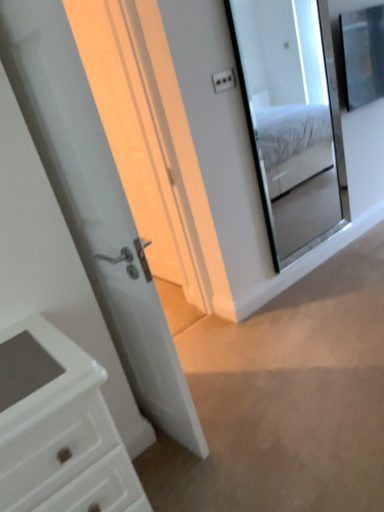
Question: Can white glossy door at center be found inside clear glass mirror at upper right?

Choices:
 (A) no
 (B) yes

Answer: (A)

Question: Considering the relative positions of clear glass mirror at upper right and white glossy door at center in the image provided, is clear glass mirror at upper right in front of white glossy door at center?

Choices:
 (A) yes
 (B) no

Answer: (B)

Question: From the image's perspective, is clear glass mirror at upper right on white glossy door at center?

Choices:
 (A) no
 (B) yes

Answer: (B)

Question: From a real-world perspective, is clear glass mirror at upper right on top of white glossy door at center?

Choices:
 (A) no
 (B) yes

Answer: (B)

Question: Can you confirm if clear glass mirror at upper right is smaller than white glossy door at center?

Choices:
 (A) no
 (B) yes

Answer: (B)

Question: Considering the positions of white glossy door at center and clear glass mirror at upper right in the image, is white glossy door at center wider or thinner than clear glass mirror at upper right?

Choices:
 (A) wide
 (B) thin

Answer: (A)

Question: In terms of height, does white glossy door at center look taller or shorter compared to clear glass mirror at upper right?

Choices:
 (A) tall
 (B) short

Answer: (A)

Question: From a real-world perspective, relative to clear glass mirror at upper right, is white glossy door at center vertically above or below?

Choices:
 (A) above
 (B) below

Answer: (A)

Question: From the image's perspective, is white glossy door at center positioned above or below clear glass mirror at upper right?

Choices:
 (A) above
 (B) below

Answer: (B)

Question: Is white plastic light switch at upper center spatially inside white glossy door at center, or outside of it?

Choices:
 (A) outside
 (B) inside

Answer: (A)

Question: From a real-world perspective, relative to white glossy door at center, is white plastic light switch at upper center vertically above or below?

Choices:
 (A) below
 (B) above

Answer: (B)

Question: Considering the positions of white plastic light switch at upper center and white glossy door at center in the image, is white plastic light switch at upper center wider or thinner than white glossy door at center?

Choices:
 (A) thin
 (B) wide

Answer: (A)

Question: Considering their positions, is white plastic light switch at upper center located in front of or behind white glossy door at center?

Choices:
 (A) behind
 (B) front

Answer: (A)

Question: Is clear glass mirror at upper right taller or shorter than white glossy door at center?

Choices:
 (A) tall
 (B) short

Answer: (B)

Question: From the image's perspective, is clear glass mirror at upper right located above or below white glossy door at center?

Choices:
 (A) above
 (B) below

Answer: (A)